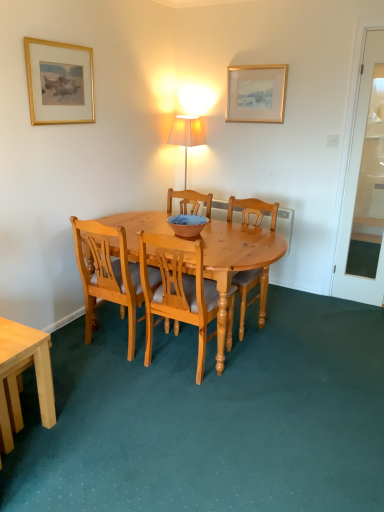
Question: Is gold-framed picture at upper left, the 2th picture frame in the right-to-left sequence, further to the viewer compared to gold framed picture at upper center, the 2th picture frame positioned from the left?

Choices:
 (A) yes
 (B) no

Answer: (B)

Question: Is gold-framed picture at upper left, which is the 1th picture frame in front-to-back order, to the left of gold framed picture at upper center, the 2th picture frame positioned from the left, from the viewer's perspective?

Choices:
 (A) yes
 (B) no

Answer: (A)

Question: Is the depth of gold-framed picture at upper left, which is the 1th picture frame from left to right, less than that of gold framed picture at upper center, the first picture frame viewed from the back?

Choices:
 (A) no
 (B) yes

Answer: (B)

Question: Can you confirm if gold-framed picture at upper left, which is the 1th picture frame from left to right, is bigger than gold framed picture at upper center, the 2th picture frame positioned from the left?

Choices:
 (A) no
 (B) yes

Answer: (B)

Question: From the image's perspective, is gold-framed picture at upper left, which is the 1th picture frame in front-to-back order, below gold framed picture at upper center, the 2th picture frame positioned from the left?

Choices:
 (A) yes
 (B) no

Answer: (A)

Question: Is gold-framed picture at upper left, which is the 1th picture frame in front-to-back order, shorter than gold framed picture at upper center, which ranks as the second picture frame in front-to-back order?

Choices:
 (A) no
 (B) yes

Answer: (A)

Question: Considering the relative positions of blue and white ceramic bowl at center and gold framed picture at upper center, the 2th picture frame positioned from the left, in the image provided, is blue and white ceramic bowl at center in front of gold framed picture at upper center, the 2th picture frame positioned from the left,?

Choices:
 (A) yes
 (B) no

Answer: (A)

Question: Is blue and white ceramic bowl at center next to gold framed picture at upper center, which ranks as the second picture frame in front-to-back order?

Choices:
 (A) yes
 (B) no

Answer: (B)

Question: From the image's perspective, is blue and white ceramic bowl at center below gold framed picture at upper center, the 2th picture frame positioned from the left?

Choices:
 (A) no
 (B) yes

Answer: (B)

Question: From a real-world perspective, is blue and white ceramic bowl at center over gold framed picture at upper center, the first picture frame viewed from the back?

Choices:
 (A) yes
 (B) no

Answer: (B)

Question: From a real-world perspective, is blue and white ceramic bowl at center physically below gold framed picture at upper center, which ranks as the second picture frame in front-to-back order?

Choices:
 (A) yes
 (B) no

Answer: (A)

Question: Is blue and white ceramic bowl at center positioned behind gold framed picture at upper center, marked as the first picture frame in a right-to-left arrangement?

Choices:
 (A) no
 (B) yes

Answer: (A)

Question: From the image's perspective, is light brown wooden chair at center, positioned as the 1th chair in right-to-left order, located beneath light brown wooden desk at lower left?

Choices:
 (A) no
 (B) yes

Answer: (A)